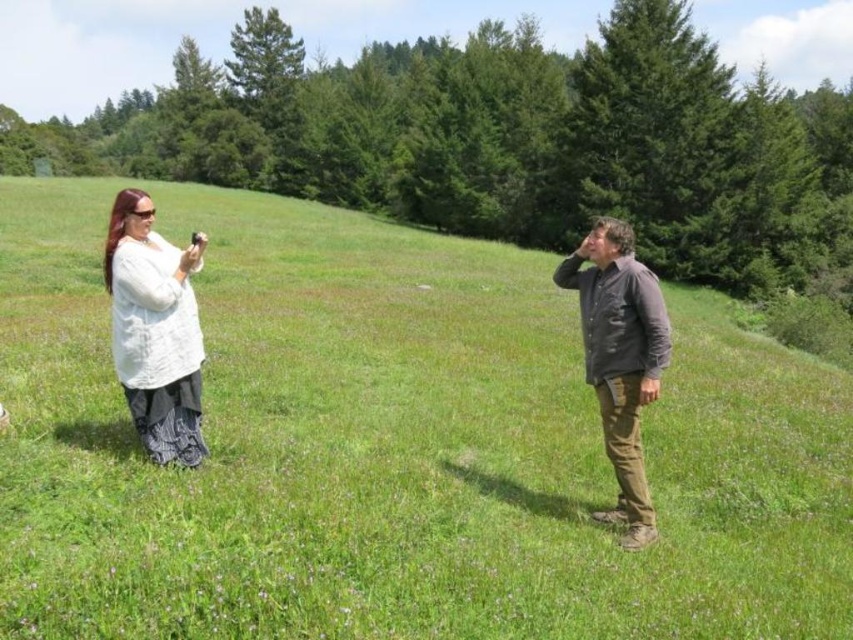
You are planning to take a photo of both the green grassy field at center and the dark brown leather jacket at center. Which object will occupy more space in your photo?

The green grassy field at center is bigger than the dark brown leather jacket at center, so it will occupy more space in the photo.

In the scene shown: You are a photographer trying to capture the scene of two people in a grassy field. You notice a point at coordinates (x=155, y=330). What object is located at that point?

The point at coordinates (x=155, y=330) indicates the white textured shirt at left.